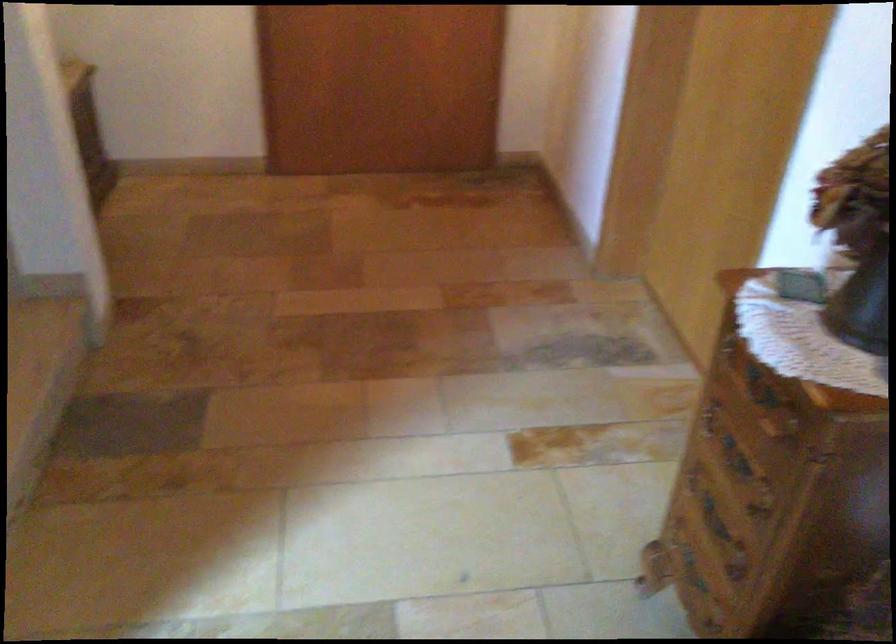
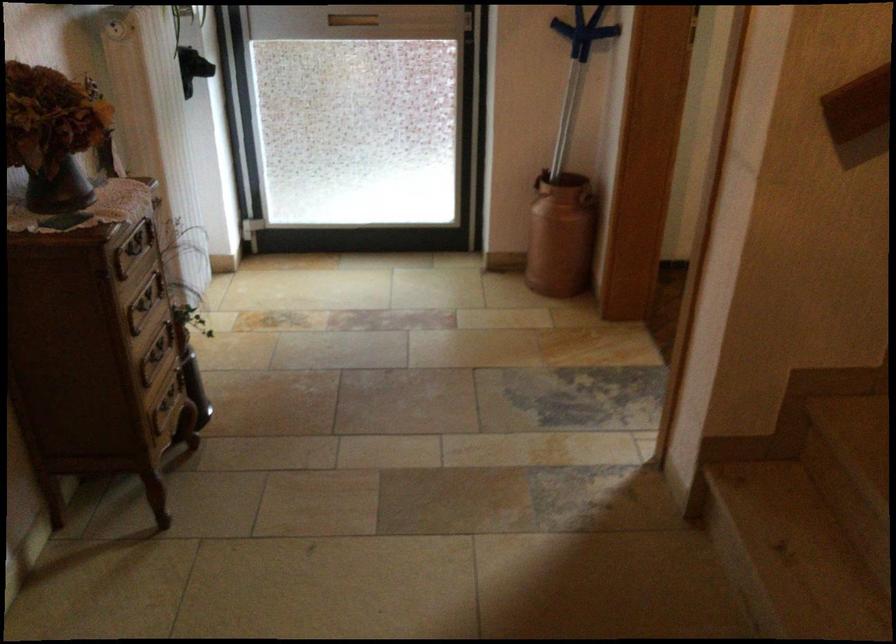
The point at (735, 531) is marked in the first image. Where is the corresponding point in the second image?

(156, 355)